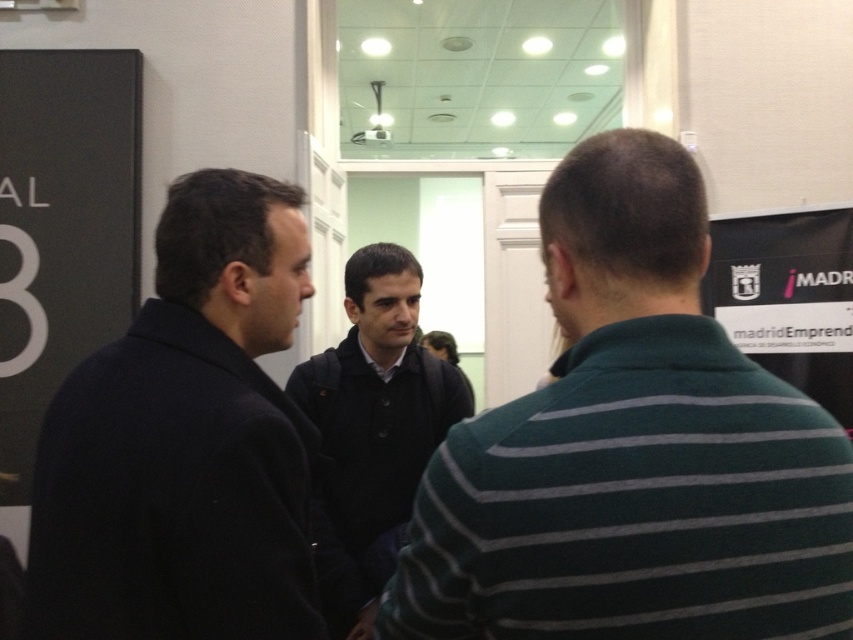
Question: Is dark blue wool coat at left positioned behind dark blue jacket at center?

Choices:
 (A) no
 (B) yes

Answer: (A)

Question: Which of these objects is positioned farthest from the dark green striped polo shirt at center?

Choices:
 (A) dark blue jacket at center
 (B) dark blue wool coat at left

Answer: (A)

Question: Does dark green striped polo shirt at center have a larger size compared to dark blue jacket at center?

Choices:
 (A) yes
 (B) no

Answer: (B)

Question: Among these points, which one is nearest to the camera?

Choices:
 (A) (778, 436)
 (B) (80, 538)
 (C) (381, 388)

Answer: (A)

Question: From the image, what is the correct spatial relationship of dark green striped polo shirt at center in relation to dark blue jacket at center?

Choices:
 (A) below
 (B) above

Answer: (B)

Question: Among these objects, which one is nearest to the camera?

Choices:
 (A) dark blue wool coat at left
 (B) dark blue jacket at center
 (C) dark green striped polo shirt at center

Answer: (C)